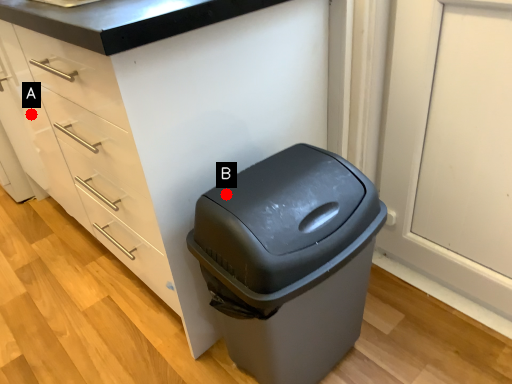
Question: Two points are circled on the image, labeled by A and B beside each circle. Which of the following is the farthest from the observer?

Choices:
 (A) A is further
 (B) B is further

Answer: (A)